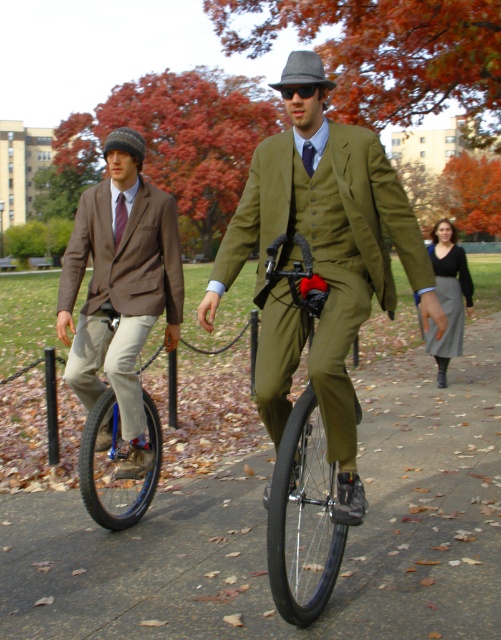
Does point (256, 196) lie behind point (280, 88)?

Yes, point (256, 196) is farther from viewer.

Can you confirm if olive green suit at center is taller than matte black fedora at center?

Incorrect, olive green suit at center's height is not larger of matte black fedora at center's.

Between point (264, 403) and point (310, 76), which one is positioned behind?

The point (264, 403) is behind.

Find the location of `olive green suit at center`. olive green suit at center is located at coordinates (322, 266).

Does shiny black unicycle at left have a lesser width compared to gray wool skirt at lower right?

Indeed, shiny black unicycle at left has a lesser width compared to gray wool skirt at lower right.

Identify the location of shiny black unicycle at left. This screenshot has height=640, width=501. (117, 433).

Between olive green suit at center and gray wool skirt at lower right, which one appears on the left side from the viewer's perspective?

olive green suit at center

Is point (361, 316) positioned before point (470, 278)?

Yes, it is.

This screenshot has width=501, height=640. In order to click on olive green suit at center in this screenshot , I will do `click(322, 266)`.